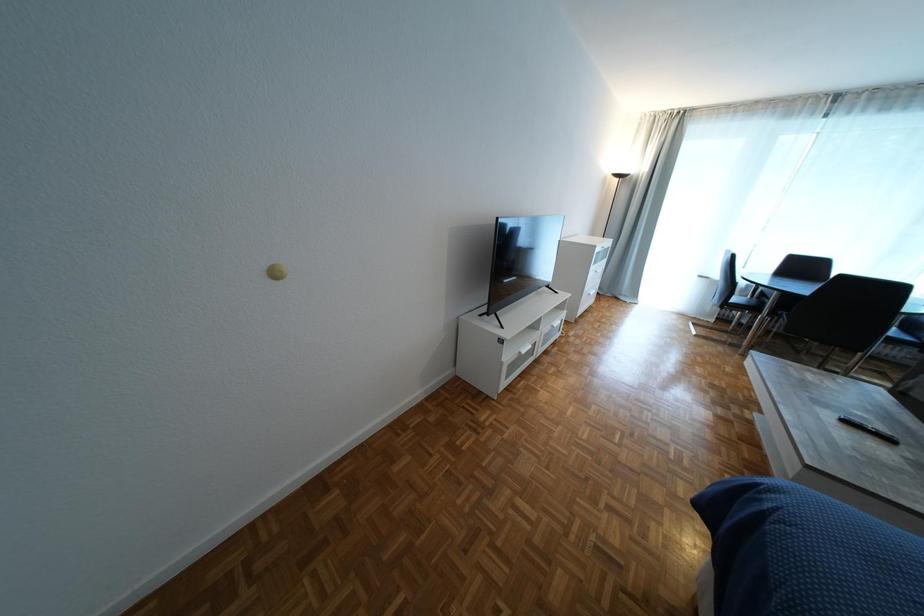
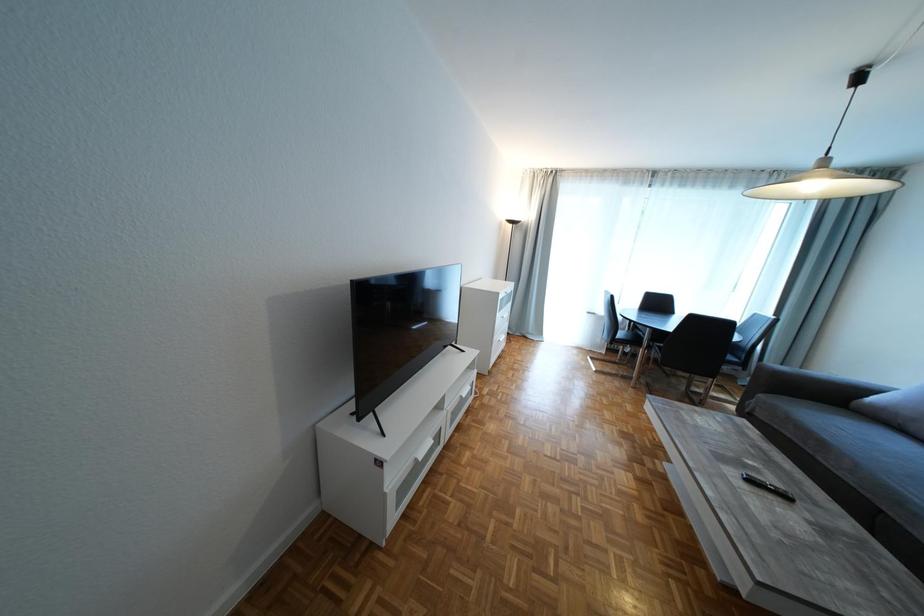
Question: The first image is from the beginning of the video and the second image is from the end. How did the camera likely rotate when shooting the video?

Choices:
 (A) Left
 (B) Right
 (C) Up
 (D) Down

Answer: (B)